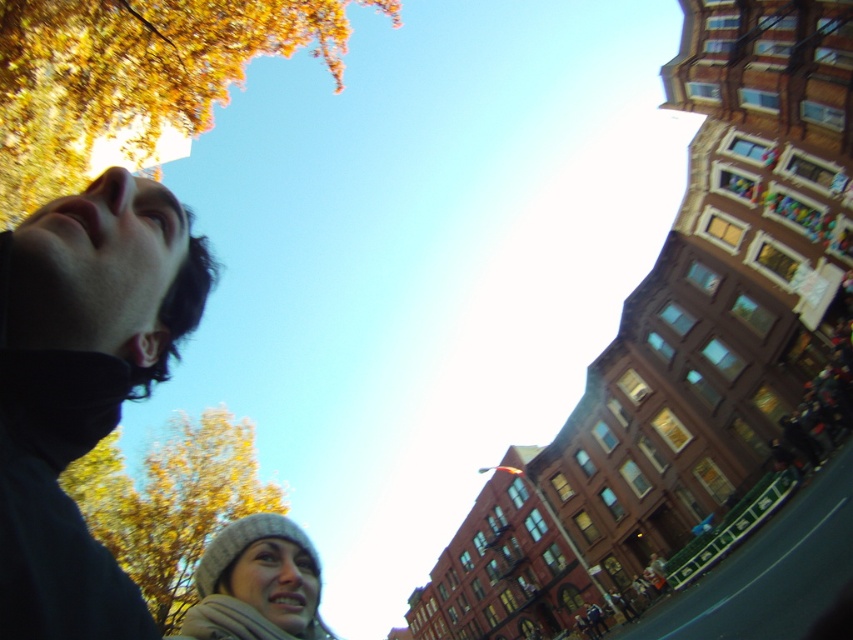
Question: Where is golden leafy tree at upper left located in relation to knitted gray hat at lower left in the image?

Choices:
 (A) left
 (B) right

Answer: (A)

Question: Is dark gray fabric face at upper left thinner than yellow leafy tree at lower left?

Choices:
 (A) yes
 (B) no

Answer: (A)

Question: Among these points, which one is nearest to the camera?

Choices:
 (A) (245, 529)
 (B) (120, 582)

Answer: (B)

Question: Does dark gray fabric face at upper left appear on the left side of white soft scarf at lower center?

Choices:
 (A) yes
 (B) no

Answer: (A)

Question: Estimate the real-world distances between objects in this image. Which object is farther from the yellow leafy tree at lower left?

Choices:
 (A) knitted gray hat at lower left
 (B) golden leafy tree at upper left
 (C) white soft scarf at lower center

Answer: (C)

Question: Estimate the real-world distances between objects in this image. Which object is closer to the dark gray fabric face at upper left?

Choices:
 (A) yellow leafy tree at lower left
 (B) white soft scarf at lower center

Answer: (B)